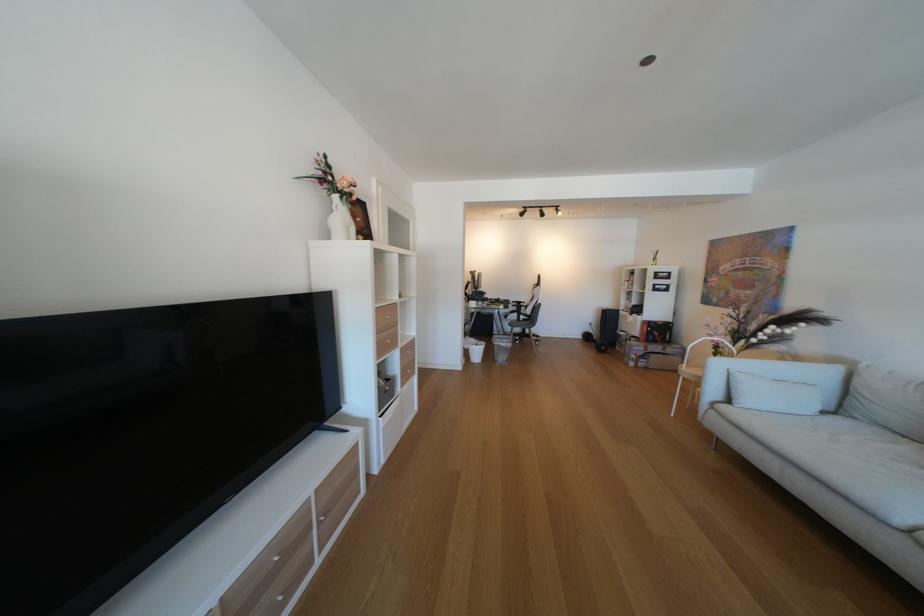
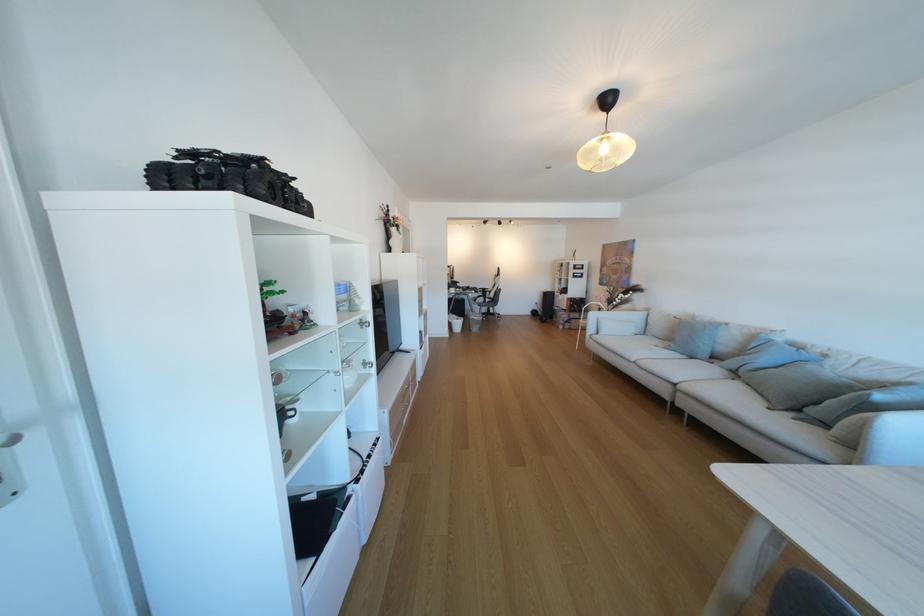
In the second image, find the point that corresponds to point 488,346 in the first image.

(468, 321)